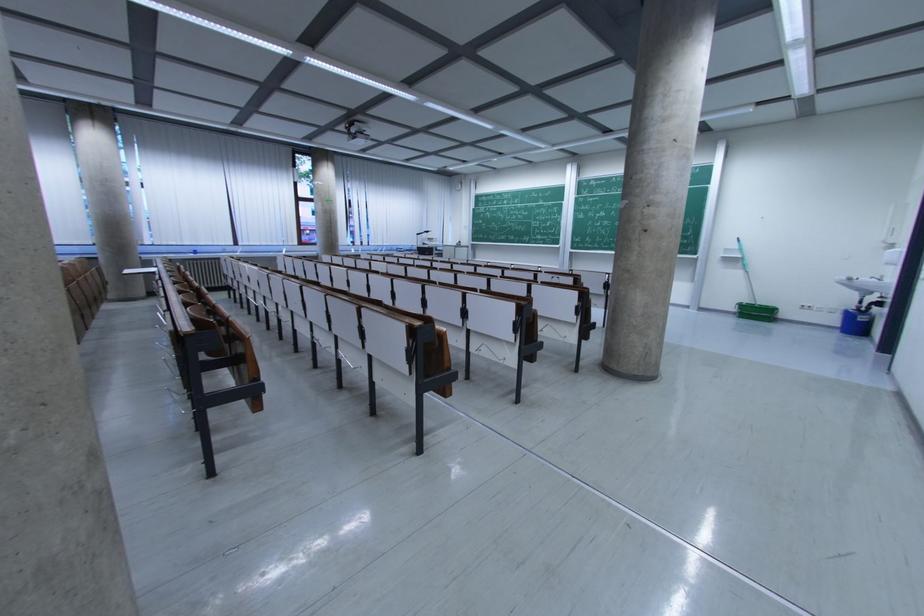
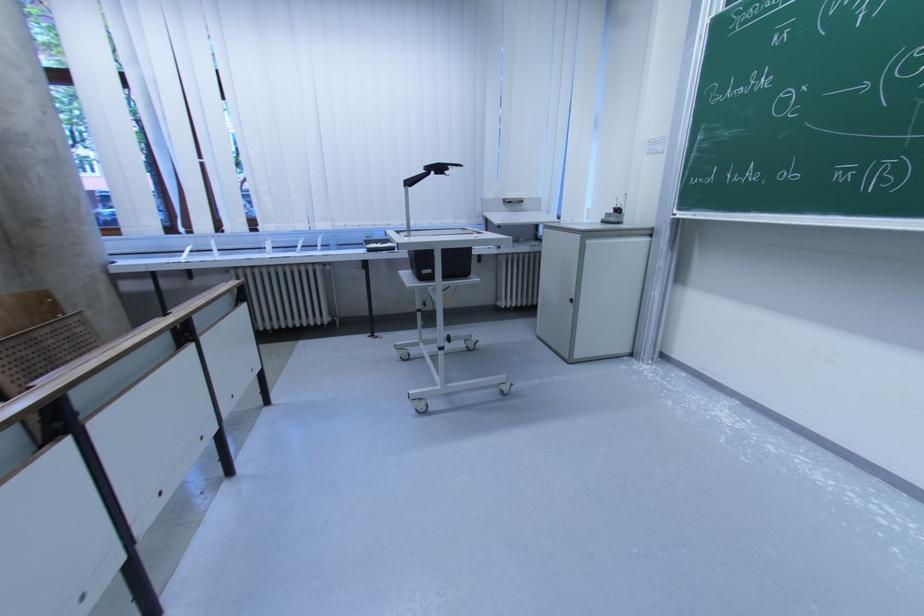
Locate, in the second image, the point that corresponds to point (422, 237) in the first image.

(415, 185)